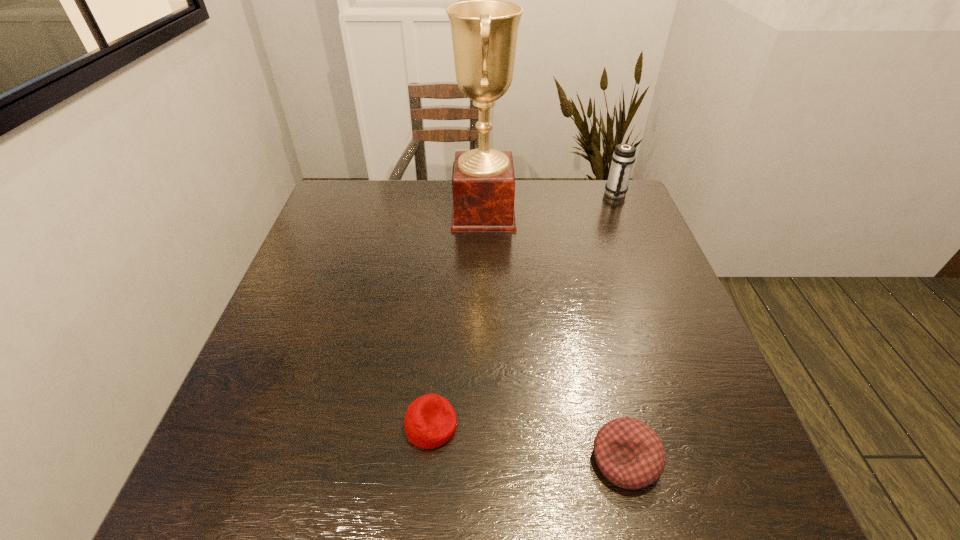
The image size is (960, 540). Find the location of `empty space that is in between the taller beanbag and the shortest object`. empty space that is in between the taller beanbag and the shortest object is located at coordinates [528, 442].

Where is `free space between the taller beanbag and the trophy cup`? This screenshot has height=540, width=960. free space between the taller beanbag and the trophy cup is located at coordinates pos(554,336).

I want to click on vacant space in between the third tallest object and the third shortest object, so click(620, 327).

Locate an element on the screen. object that can be found as the third closest to the third tallest object is located at coordinates (623, 157).

Point out which object is positioned as the nearest to the shorter beanbag. Please provide its 2D coordinates. Your answer should be formatted as a tuple, i.e. [(x, y)], where the tuple contains the x and y coordinates of a point satisfying the conditions above.

[(629, 453)]

At what (x,y) coordinates should I click in order to perform the action: click on vacant space that satisfies the following two spatial constraints: 1. on the side with the handle of the thermos bottle; 2. on the seat area of the left beanbag. Please return your answer as a coordinate pair (x, y). Looking at the image, I should click on (710, 426).

The height and width of the screenshot is (540, 960). In order to click on free space that satisfies the following two spatial constraints: 1. on the plaque of the tallest object; 2. on the left side of the second object from right to left in this screenshot , I will do `click(486, 460)`.

At what (x,y) coordinates should I click in order to perform the action: click on vacant area that satisfies the following two spatial constraints: 1. on the plaque of the second shortest object; 2. on the right side of the tallest object. Please return your answer as a coordinate pair (x, y). Looking at the image, I should click on (486, 460).

Where is `free location that satisfies the following two spatial constraints: 1. on the side with the handle of the second tallest object; 2. on the seat area of the shorter beanbag`? The image size is (960, 540). free location that satisfies the following two spatial constraints: 1. on the side with the handle of the second tallest object; 2. on the seat area of the shorter beanbag is located at coordinates (710, 426).

Locate an element on the screen. This screenshot has height=540, width=960. free spot that satisfies the following two spatial constraints: 1. on the seat area of the shorter beanbag; 2. on the left side of the second object from right to left is located at coordinates (428, 460).